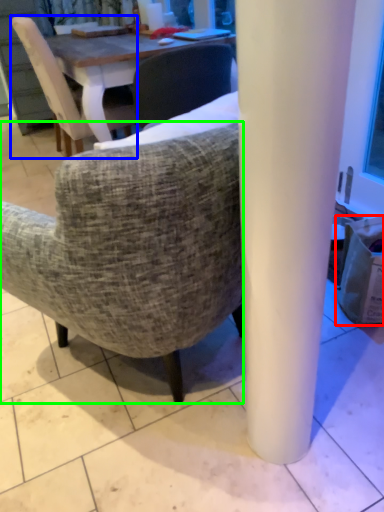
Question: Estimate the real-world distances between objects in this image. Which object is farther from trash bin/can (highlighted by a red box), chair (highlighted by a blue box) or chair (highlighted by a green box)?

Choices:
 (A) chair
 (B) chair

Answer: (A)